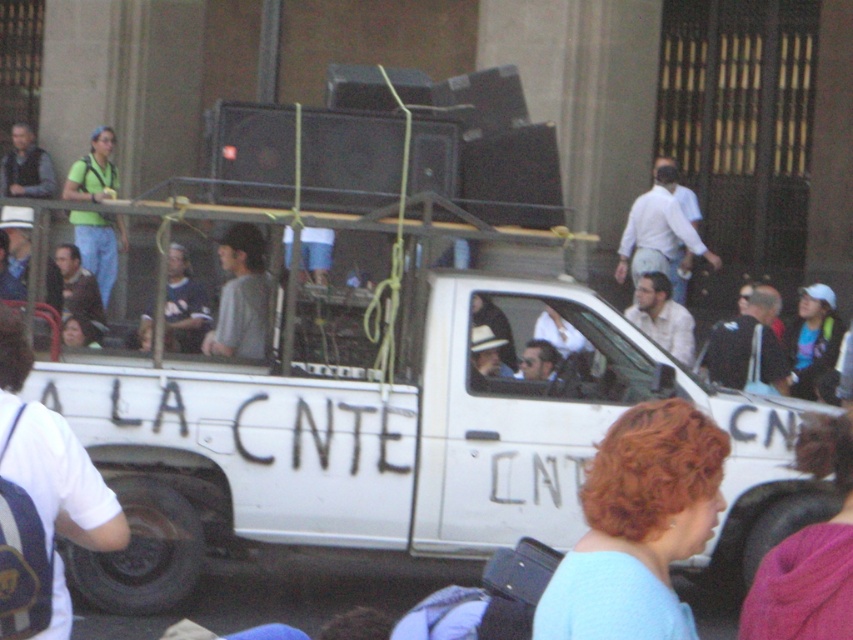
Question: Based on their relative distances, which object is farther from the light brown hair at lower right?

Choices:
 (A) white fabric cap at upper right
 (B) green matte shirt at upper left
 (C) black leather jacket at center
 (D) gray matte shirt at center

Answer: (B)

Question: Which object is closer to the camera taking this photo?

Choices:
 (A) black leather jacket at center
 (B) light brown hair at lower right

Answer: (B)

Question: In this image, where is white shirt at center located relative to dark blue shirt at center?

Choices:
 (A) below
 (B) above

Answer: (B)

Question: Is white matte truck at center wider than light blue fabric at center?

Choices:
 (A) no
 (B) yes

Answer: (B)

Question: Which is farther from the light blue fabric at center?

Choices:
 (A) black leather jacket at center
 (B) green matte shirt at upper left
 (C) dark blue shirt at center
 (D) white matte truck at center

Answer: (B)

Question: Can you confirm if light blue fabric at center is wider than white fabric cap at upper right?

Choices:
 (A) no
 (B) yes

Answer: (A)